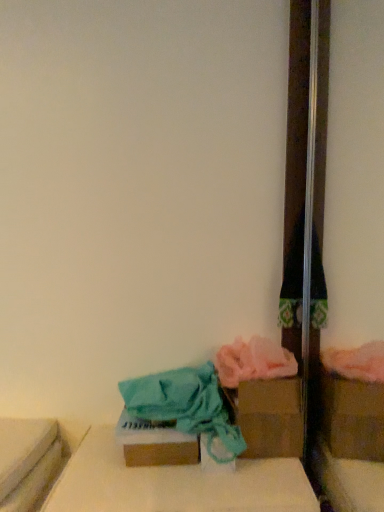
Question: Does brown cardboard box at lower right, which appears as the first storage box when viewed from the right, have a smaller size compared to brown cardboard box at lower center, the first storage box from the left?

Choices:
 (A) yes
 (B) no

Answer: (B)

Question: From a real-world perspective, is brown cardboard box at lower right, the second storage box positioned from the front, physically below brown cardboard box at lower center, the 2th storage box when ordered from back to front?

Choices:
 (A) no
 (B) yes

Answer: (A)

Question: From the image's perspective, does brown cardboard box at lower right, the second storage box positioned from the front, appear higher than brown cardboard box at lower center, acting as the 2th storage box starting from the right?

Choices:
 (A) no
 (B) yes

Answer: (B)

Question: Is brown cardboard box at lower center, the first storage box from the left, a part of brown cardboard box at lower right, the second storage box positioned from the front?

Choices:
 (A) no
 (B) yes

Answer: (A)

Question: Is brown cardboard box at lower right, the first storage box positioned from the back, shorter than brown cardboard box at lower center, the 2th storage box when ordered from back to front?

Choices:
 (A) no
 (B) yes

Answer: (A)

Question: Is cardboard box at lower center spatially inside brown cardboard box at lower center, placed as the first storage box when sorted from front to back, or outside of it?

Choices:
 (A) outside
 (B) inside

Answer: (A)

Question: Visually, is cardboard box at lower center positioned to the left or to the right of brown cardboard box at lower center, placed as the first storage box when sorted from front to back?

Choices:
 (A) left
 (B) right

Answer: (B)

Question: Is cardboard box at lower center taller or shorter than brown cardboard box at lower center, the first storage box from the left?

Choices:
 (A) tall
 (B) short

Answer: (B)

Question: Relative to brown cardboard box at lower center, the first storage box from the left, is cardboard box at lower center in front or behind?

Choices:
 (A) front
 (B) behind

Answer: (A)

Question: In terms of size, does cardboard box at lower center appear bigger or smaller than brown cardboard box at lower right, the second storage box positioned from the front?

Choices:
 (A) big
 (B) small

Answer: (A)

Question: Considering the relative positions of cardboard box at lower center and brown cardboard box at lower right, the second storage box positioned from the front, in the image provided, is cardboard box at lower center to the left or to the right of brown cardboard box at lower right, the second storage box positioned from the front,?

Choices:
 (A) left
 (B) right

Answer: (A)

Question: From a real-world perspective, is cardboard box at lower center physically located above or below brown cardboard box at lower right, the first storage box positioned from the back?

Choices:
 (A) above
 (B) below

Answer: (B)

Question: Considering their positions, is cardboard box at lower center located in front of or behind brown cardboard box at lower right, the first storage box positioned from the back?

Choices:
 (A) behind
 (B) front

Answer: (B)

Question: Based on their sizes in the image, would you say brown cardboard box at lower center, the first storage box from the left, is bigger or smaller than cardboard box at lower center?

Choices:
 (A) small
 (B) big

Answer: (A)

Question: Would you say brown cardboard box at lower center, placed as the first storage box when sorted from front to back, is inside or outside cardboard box at lower center?

Choices:
 (A) inside
 (B) outside

Answer: (B)